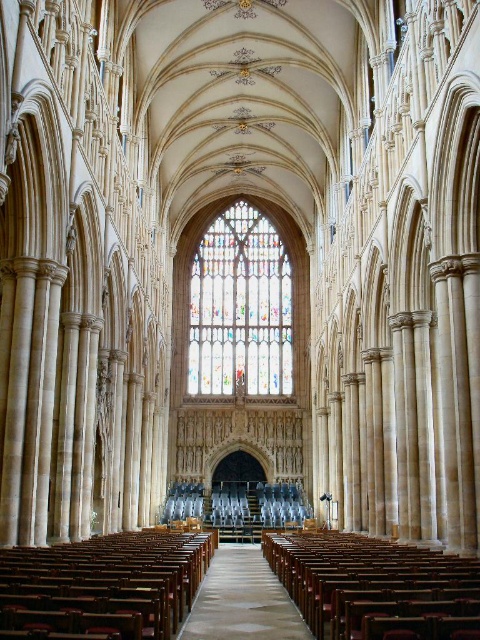
Can you confirm if multicolored stained glass at center is taller than wooden polished aisle at center?

Correct, multicolored stained glass at center is much taller as wooden polished aisle at center.

Does multicolored stained glass at center lie in front of wooden polished aisle at center?

No, it is behind wooden polished aisle at center.

Who is more distant from viewer, (244,248) or (268,620)?

Point (244,248)

This screenshot has width=480, height=640. Find the location of `multicolored stained glass at center`. multicolored stained glass at center is located at coordinates click(x=240, y=307).